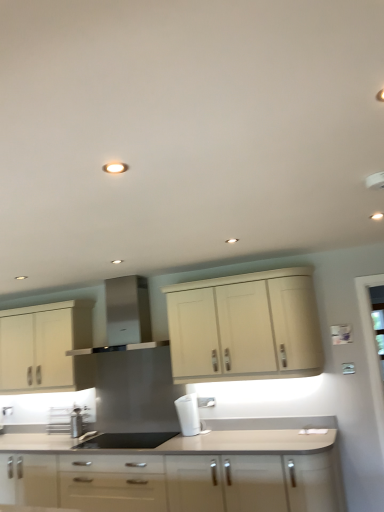
Question: From a real-world perspective, is matte white cabinets at center, marked as the first cabinetry in a bottom-to-top arrangement, located beneath stainless steel range hood at center?

Choices:
 (A) yes
 (B) no

Answer: (A)

Question: Considering the relative positions of matte white cabinets at center, marked as the third cabinetry in a top-to-bottom arrangement, and stainless steel range hood at center in the image provided, is matte white cabinets at center, marked as the third cabinetry in a top-to-bottom arrangement, to the right of stainless steel range hood at center from the viewer's perspective?

Choices:
 (A) no
 (B) yes

Answer: (A)

Question: Does matte white cabinets at center, marked as the first cabinetry in a bottom-to-top arrangement, appear on the left side of stainless steel range hood at center?

Choices:
 (A) yes
 (B) no

Answer: (A)

Question: Is matte white cabinets at center, marked as the first cabinetry in a bottom-to-top arrangement, with stainless steel range hood at center?

Choices:
 (A) yes
 (B) no

Answer: (B)

Question: Considering the relative sizes of matte white cabinets at center, marked as the first cabinetry in a bottom-to-top arrangement, and stainless steel range hood at center in the image provided, is matte white cabinets at center, marked as the first cabinetry in a bottom-to-top arrangement, taller than stainless steel range hood at center?

Choices:
 (A) no
 (B) yes

Answer: (B)

Question: From the image's perspective, is matte cream cabinet at upper center, positioned as the third cabinetry in bottom-to-top order, positioned above or below matte cream cabinet at left, which is the second cabinetry from bottom to top?

Choices:
 (A) below
 (B) above

Answer: (B)

Question: Is matte cream cabinet at upper center, positioned as the third cabinetry in bottom-to-top order, bigger or smaller than matte cream cabinet at left, which is the 2th cabinetry in top-to-bottom order?

Choices:
 (A) small
 (B) big

Answer: (A)

Question: In terms of height, does matte cream cabinet at upper center, the first cabinetry viewed from the top, look taller or shorter compared to matte cream cabinet at left, which is the second cabinetry from bottom to top?

Choices:
 (A) short
 (B) tall

Answer: (A)

Question: Considering the relative positions of matte cream cabinet at upper center, positioned as the third cabinetry in bottom-to-top order, and matte cream cabinet at left, which is the second cabinetry from bottom to top, in the image provided, is matte cream cabinet at upper center, positioned as the third cabinetry in bottom-to-top order, to the left or to the right of matte cream cabinet at left, which is the second cabinetry from bottom to top,?

Choices:
 (A) right
 (B) left

Answer: (A)

Question: From a real-world perspective, is stainless steel range hood at center physically located above or below matte cream cabinet at upper center, positioned as the third cabinetry in bottom-to-top order?

Choices:
 (A) above
 (B) below

Answer: (A)

Question: From the image's perspective, is stainless steel range hood at center located above or below matte cream cabinet at upper center, positioned as the third cabinetry in bottom-to-top order?

Choices:
 (A) above
 (B) below

Answer: (A)

Question: Is stainless steel range hood at center taller or shorter than matte cream cabinet at upper center, positioned as the third cabinetry in bottom-to-top order?

Choices:
 (A) tall
 (B) short

Answer: (B)

Question: Is stainless steel range hood at center bigger or smaller than matte cream cabinet at upper center, positioned as the third cabinetry in bottom-to-top order?

Choices:
 (A) big
 (B) small

Answer: (B)

Question: Relative to white plastic coffee machine at center, is metallic stainless steel spice rack at lower left in front or behind?

Choices:
 (A) behind
 (B) front

Answer: (A)

Question: In terms of size, does metallic stainless steel spice rack at lower left appear bigger or smaller than white plastic coffee machine at center?

Choices:
 (A) small
 (B) big

Answer: (B)